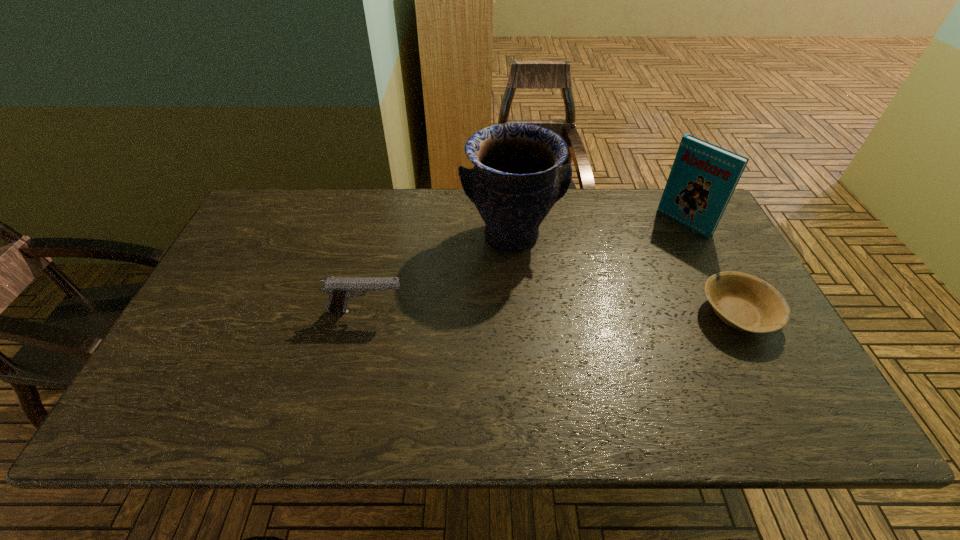
Where is `the leftmost object`? This screenshot has height=540, width=960. the leftmost object is located at coordinates (340, 289).

This screenshot has height=540, width=960. Find the location of `pistol`. pistol is located at coordinates (340, 289).

What are the coordinates of `the shortest object` in the screenshot? It's located at (745, 302).

The width and height of the screenshot is (960, 540). I want to click on book, so click(703, 177).

Identify the location of pottery. (517, 179).

Identify the location of blank space located at the barrel of the leftmost object. This screenshot has width=960, height=540. coord(510,312).

Locate an element on the screen. free location located on the left of the bowl is located at coordinates (577, 314).

At what (x,y) coordinates should I click in order to perform the action: click on free space located on the front cover of the book. Please return your answer as a coordinate pair (x, y). This screenshot has width=960, height=540. Looking at the image, I should click on (611, 282).

Find the location of a particular element. This screenshot has width=960, height=540. vacant space located on the front cover of the book is located at coordinates (661, 242).

Locate an element on the screen. The width and height of the screenshot is (960, 540). vacant region located on the front cover of the book is located at coordinates (599, 292).